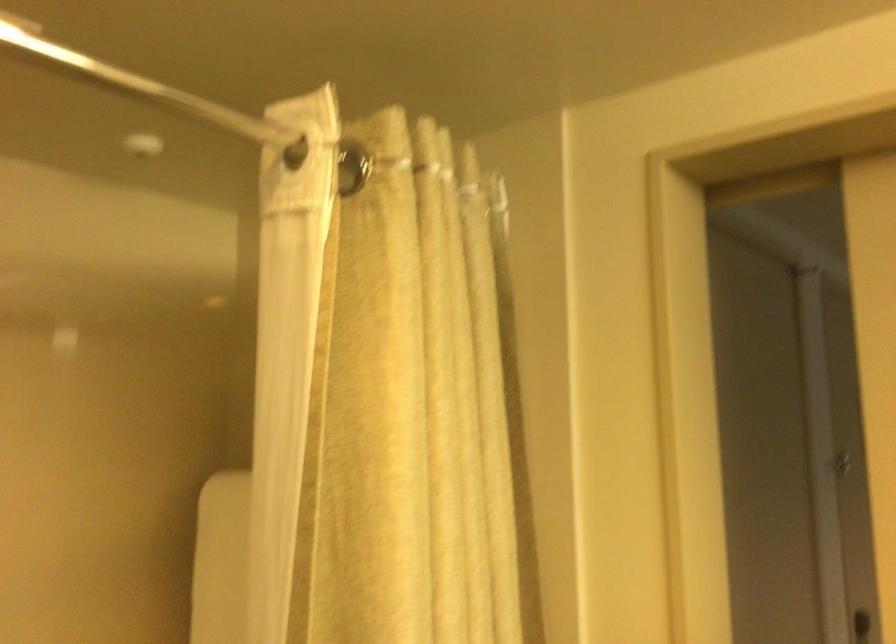
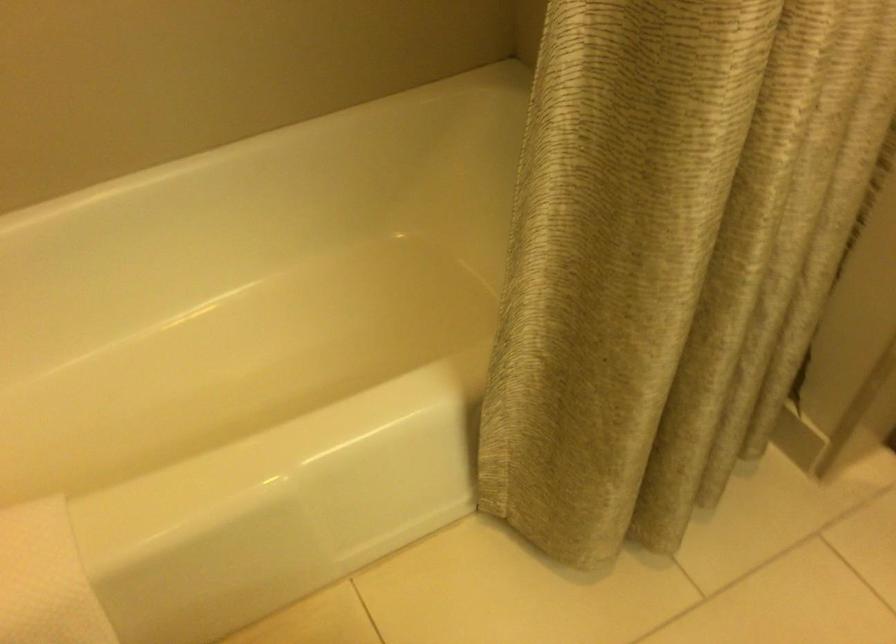
Based on the continuous images, in which direction is the camera rotating?

The camera rotated toward left-down.